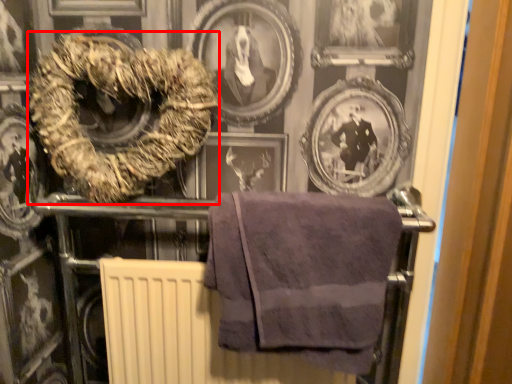
Question: Observing the image, what is the correct spatial positioning of towel (annotated by the red box) in reference to towel?

Choices:
 (A) right
 (B) left

Answer: (B)